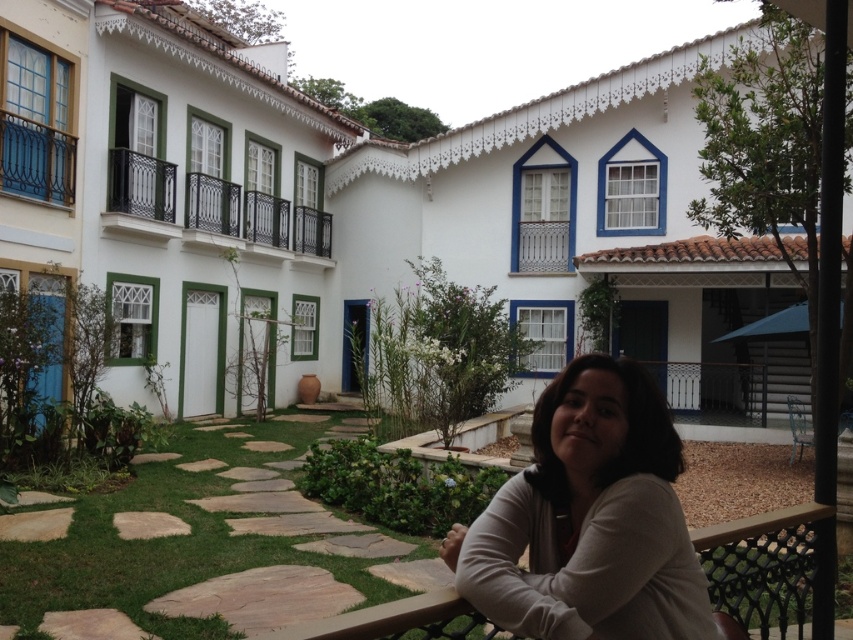
Question: Which point appears closest to the camera in this image?

Choices:
 (A) (288, 212)
 (B) (753, 541)
 (C) (611, 540)

Answer: (C)

Question: Which of the following is the closest to the observer?

Choices:
 (A) white matte shirt at lower right
 (B) brown wooden balustrade at lower right

Answer: (A)

Question: Is white matte shirt at lower right positioned in front of black wrought iron balcony at upper left?

Choices:
 (A) no
 (B) yes

Answer: (B)

Question: Can you confirm if white matte shirt at lower right is positioned to the left of black wrought iron balcony at upper left?

Choices:
 (A) yes
 (B) no

Answer: (B)

Question: Which of the following is the farthest from the observer?

Choices:
 (A) white matte shirt at lower right
 (B) matte blue balcony at upper left

Answer: (B)

Question: Does white matte shirt at lower right lie in front of matte blue balcony at upper left?

Choices:
 (A) yes
 (B) no

Answer: (A)